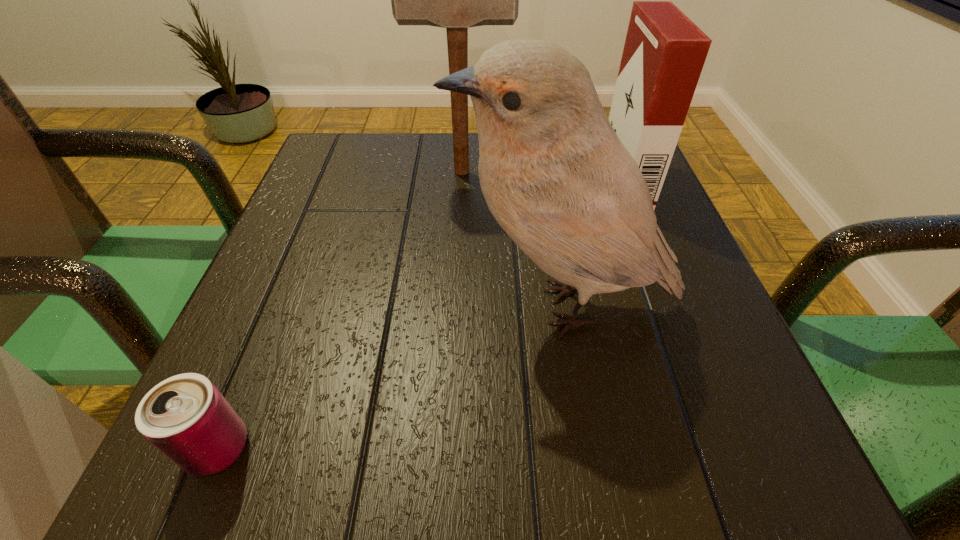
You are a GUI agent. You are given a task and a screenshot of the screen. Output one action in this format:
    pyautogui.click(x=<x>, y=<y>)
    Task: Click on the free space located 0.170m on the front-facing side of the second shortest object
    
    Given the screenshot: What is the action you would take?
    pyautogui.click(x=529, y=181)

Identify the location of free point located on the right of the nearest object. (291, 448).

This screenshot has width=960, height=540. Find the location of `mallet present at the far edge`. mallet present at the far edge is located at coordinates (456, 0).

Find the location of `cigarette_case that is positioned at the far edge`. cigarette_case that is positioned at the far edge is located at coordinates (664, 53).

Locate an element on the screen. object at the near edge is located at coordinates (186, 417).

I want to click on object located in the left edge section of the desktop, so click(x=186, y=417).

Find the location of `parakeet that is at the right edge`. parakeet that is at the right edge is located at coordinates (554, 174).

Locate an element on the screen. cigarette_case situated at the right edge is located at coordinates (664, 53).

Identify the location of object located in the near left corner section of the desktop. (186, 417).

The height and width of the screenshot is (540, 960). What are the coordinates of `object positioned at the far right corner` in the screenshot? It's located at (664, 53).